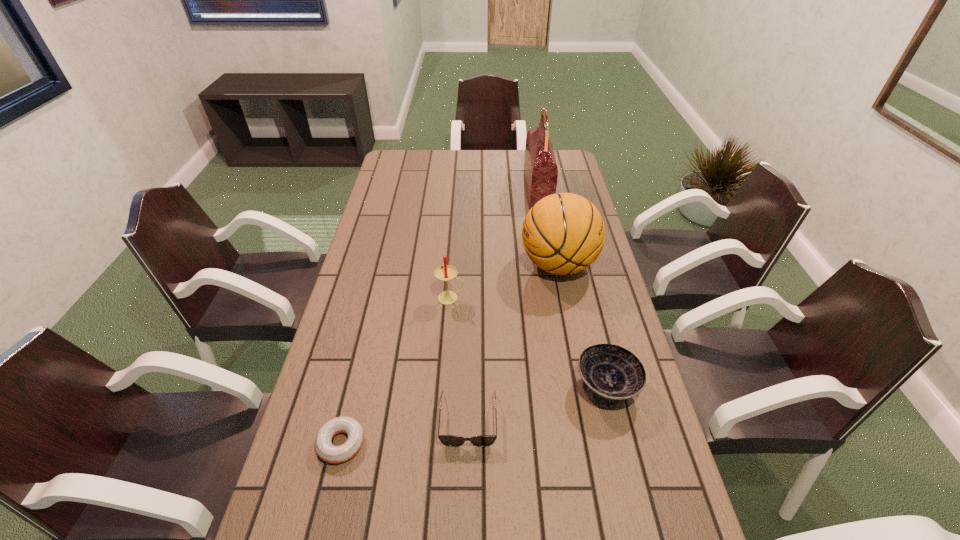
Locate an element on the screen. The height and width of the screenshot is (540, 960). the tallest object is located at coordinates (540, 168).

The height and width of the screenshot is (540, 960). I want to click on the farthest object, so click(540, 168).

Identify the location of basketball. (563, 233).

Find the location of a particular element. The height and width of the screenshot is (540, 960). the fourth shortest object is located at coordinates (446, 273).

At what (x,y) coordinates should I click in order to perform the action: click on bowl. Please return your answer as a coordinate pair (x, y). This screenshot has height=540, width=960. Looking at the image, I should click on (611, 374).

You are a GUI agent. You are given a task and a screenshot of the screen. Output one action in this format:
    pyautogui.click(x=<x>, y=<y>)
    Task: Click on the sunglasses
    
    Given the screenshot: What is the action you would take?
    pyautogui.click(x=449, y=440)

You are a GUI agent. You are given a task and a screenshot of the screen. Output one action in this format:
    pyautogui.click(x=<x>, y=<y>)
    Task: Click on the leftmost object
    The height and width of the screenshot is (540, 960).
    Given the screenshot: What is the action you would take?
    pyautogui.click(x=325, y=450)

Image resolution: width=960 pixels, height=540 pixels. Identify the location of doughnut. (325, 450).

The width and height of the screenshot is (960, 540). Find the location of `free region located 0.390m on the front-facing side of the handbag`. free region located 0.390m on the front-facing side of the handbag is located at coordinates click(x=432, y=190).

Find the location of a particular element. This screenshot has width=960, height=540. vacant space situated 0.390m on the front-facing side of the handbag is located at coordinates (432, 190).